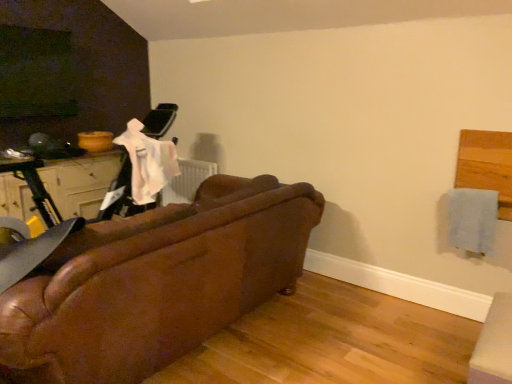
Question: From a real-world perspective, is leather couch at center beneath matte white drawer at left?

Choices:
 (A) no
 (B) yes

Answer: (B)

Question: Is leather couch at center shorter than matte white drawer at left?

Choices:
 (A) no
 (B) yes

Answer: (A)

Question: Is leather couch at center positioned behind matte white drawer at left?

Choices:
 (A) yes
 (B) no

Answer: (B)

Question: Is there a large distance between leather couch at center and matte white drawer at left?

Choices:
 (A) yes
 (B) no

Answer: (A)

Question: Can you see leather couch at center touching matte white drawer at left?

Choices:
 (A) no
 (B) yes

Answer: (A)

Question: Is leather couch at center not inside matte white drawer at left?

Choices:
 (A) yes
 (B) no

Answer: (A)

Question: Is matte white drawer at left wider than leather couch at center?

Choices:
 (A) no
 (B) yes

Answer: (A)

Question: Are matte white drawer at left and leather couch at center far apart?

Choices:
 (A) no
 (B) yes

Answer: (B)

Question: From a real-world perspective, is matte white drawer at left positioned over leather couch at center based on gravity?

Choices:
 (A) no
 (B) yes

Answer: (B)

Question: Is matte white drawer at left outside of leather couch at center?

Choices:
 (A) no
 (B) yes

Answer: (B)

Question: Can you confirm if matte white drawer at left is bigger than leather couch at center?

Choices:
 (A) yes
 (B) no

Answer: (B)

Question: Is matte white drawer at left at the left side of leather couch at center?

Choices:
 (A) no
 (B) yes

Answer: (B)

Question: Considering the relative sizes of light blue fabric at upper right and matte white drawer at left in the image provided, is light blue fabric at upper right shorter than matte white drawer at left?

Choices:
 (A) yes
 (B) no

Answer: (A)